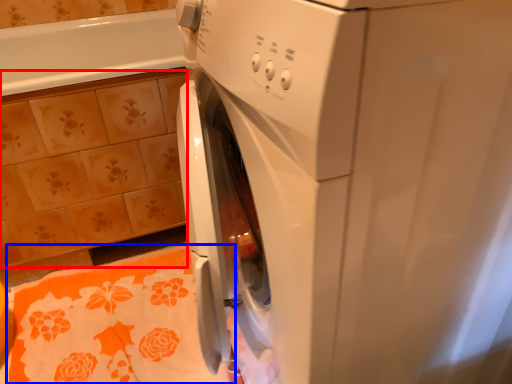
Question: Which of the following is the closest to the observer, ceramic tile (highlighted by a red box) or bath towel (highlighted by a blue box)?

Choices:
 (A) ceramic tile
 (B) bath towel

Answer: (B)